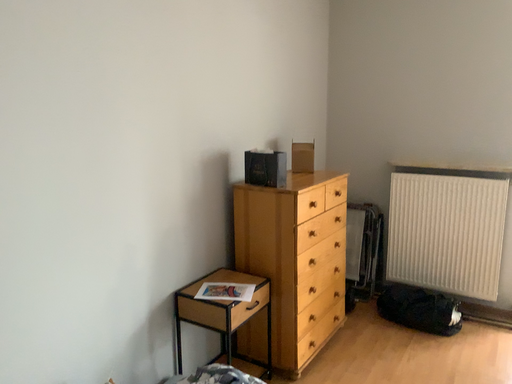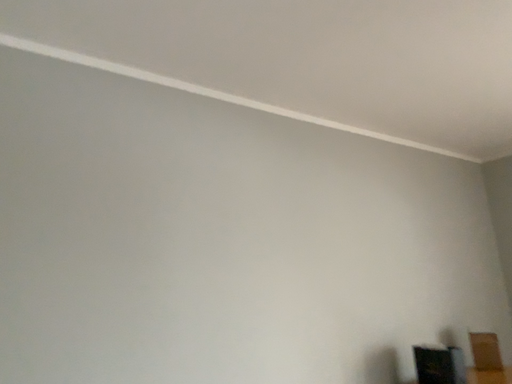
Question: How did the camera likely rotate when shooting the video?

Choices:
 (A) rotated right
 (B) rotated left

Answer: (B)